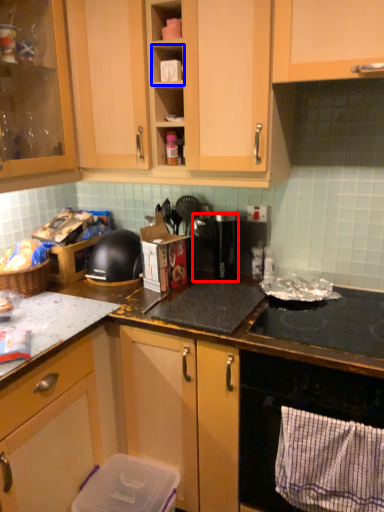
Question: Which object is closer to the camera taking this photo, appliance (highlighted by a red box) or shelf (highlighted by a blue box)?

Choices:
 (A) appliance
 (B) shelf

Answer: (B)